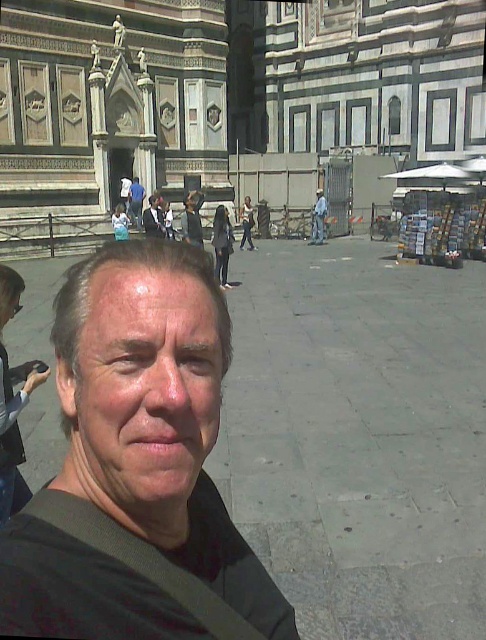
Looking at this image, between matte black shirt at center and light blue jeans at center, which one has less height?

With less height is light blue jeans at center.

Between point (146, 388) and point (314, 227), which one is positioned behind?

The point (314, 227) is more distant.

This screenshot has height=640, width=486. Identify the location of matte black shirt at center. (138, 467).